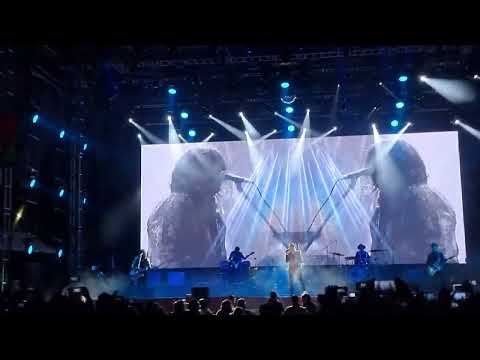
Locate an element on the screen. This screenshot has height=360, width=480. large screen is located at coordinates (447, 153).